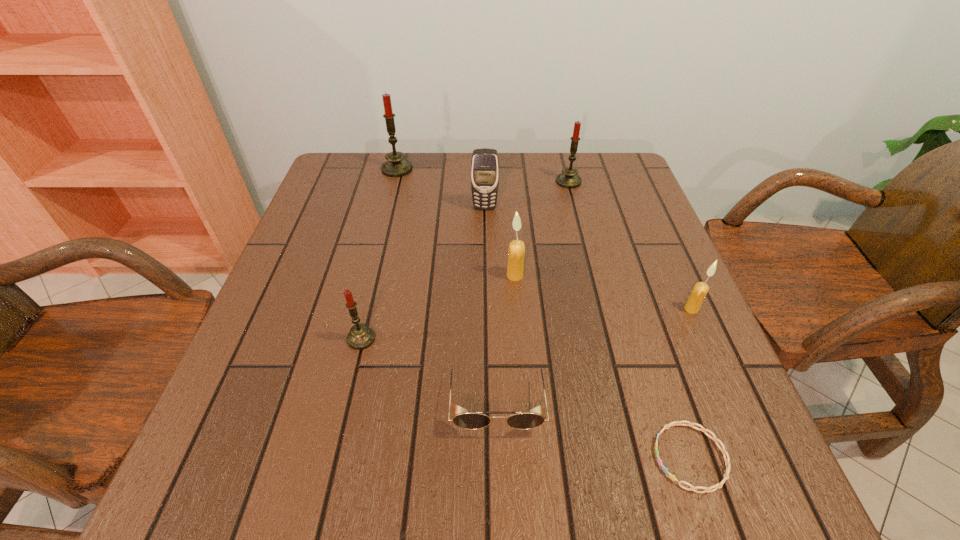
Locate an element on the screen. This screenshot has width=960, height=540. the biggest red candle is located at coordinates (396, 166).

Where is `the tallest candle`? the tallest candle is located at coordinates (396, 166).

Locate an element on the screen. The width and height of the screenshot is (960, 540). the fourth candle from left to right is located at coordinates (568, 178).

Locate an element on the screen. This screenshot has width=960, height=540. the second biggest red candle is located at coordinates (568, 178).

What are the coordinates of `the third candle from right to left` in the screenshot? It's located at (516, 252).

The width and height of the screenshot is (960, 540). Find the location of `the left cream candle`. the left cream candle is located at coordinates (516, 252).

The image size is (960, 540). I want to click on cellular telephone, so click(485, 163).

The image size is (960, 540). Find the location of `the third nearest object`. the third nearest object is located at coordinates (360, 337).

Identify the location of the nearest candle. This screenshot has width=960, height=540. (360, 337).

You are a GUI agent. You are given a task and a screenshot of the screen. Output one action in this format:
    pyautogui.click(x=<x>, y=<y>)
    Task: Click on the nearer cream candle
    
    Given the screenshot: What is the action you would take?
    pyautogui.click(x=700, y=290)